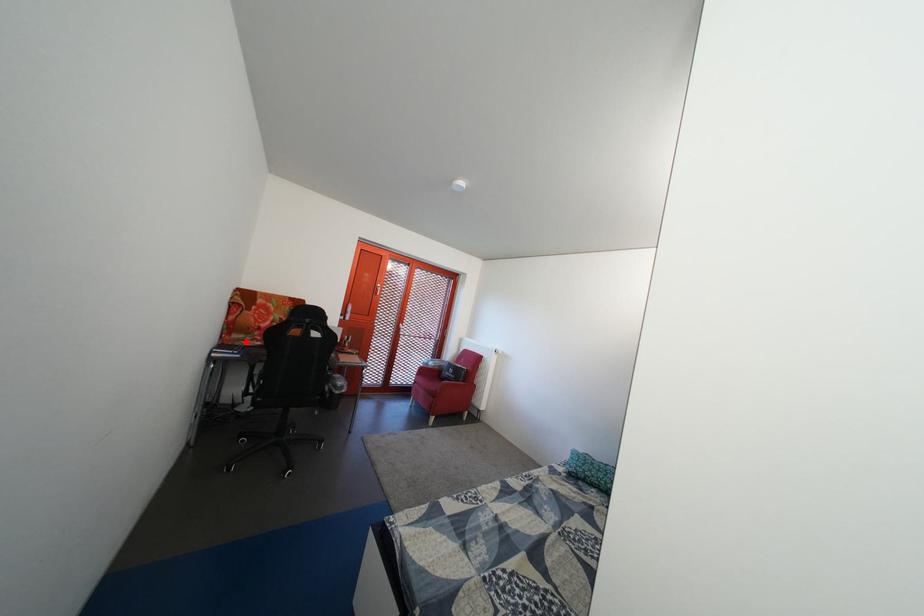
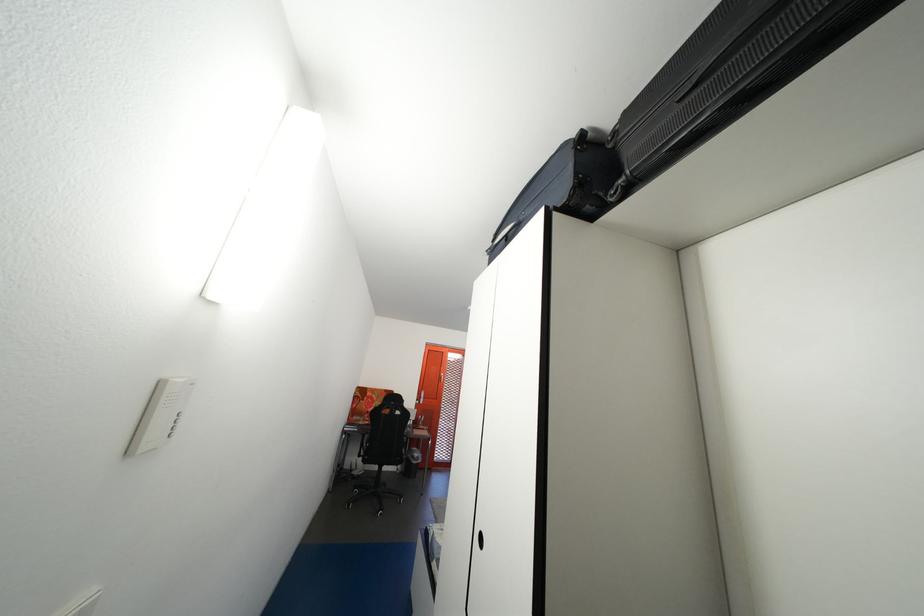
The point at the highlighted location is marked in the first image. Where is the corresponding point in the second image?

(367, 424)